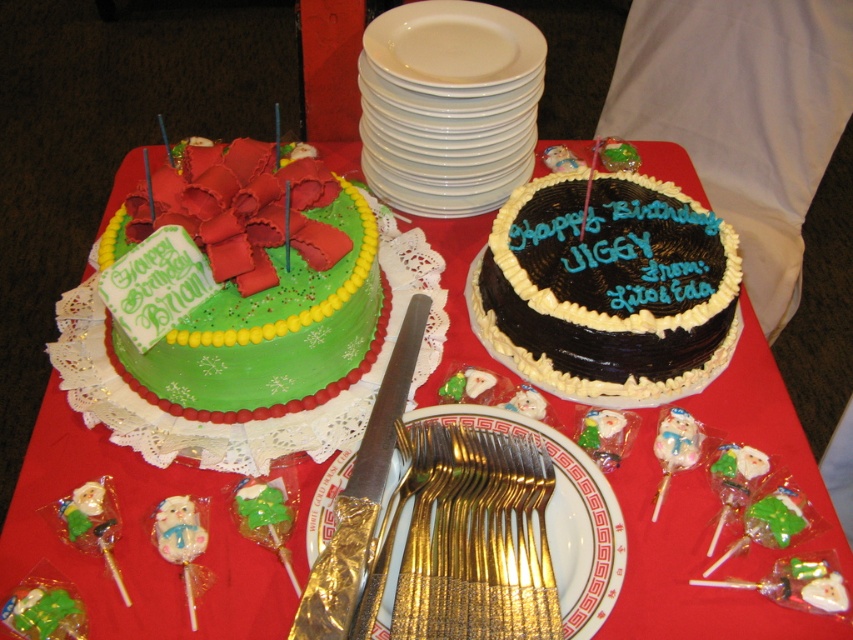
Is white glossy plate at upper center wider than gold plated forks at center?

Correct, the width of white glossy plate at upper center exceeds that of gold plated forks at center.

Does white glossy plate at upper center appear over gold plated forks at center?

Yes.

Locate an element on the screen. Image resolution: width=853 pixels, height=640 pixels. white glossy plate at upper center is located at coordinates (448, 106).

Who is shorter, green fondant cake at upper left or white ceramic plate at upper center?

white ceramic plate at upper center

Identify the location of green fondant cake at upper left. (256, 289).

Locate an element on the screen. The height and width of the screenshot is (640, 853). green fondant cake at upper left is located at coordinates (256, 289).

Who is positioned more to the right, chocolate frosted cake at center or gold plated forks at center?

chocolate frosted cake at center

Can you confirm if chocolate frosted cake at center is positioned above gold plated forks at center?

Yes.

Where is `chocolate frosted cake at center`? chocolate frosted cake at center is located at coordinates (608, 285).

Locate an element on the screen. chocolate frosted cake at center is located at coordinates (608, 285).